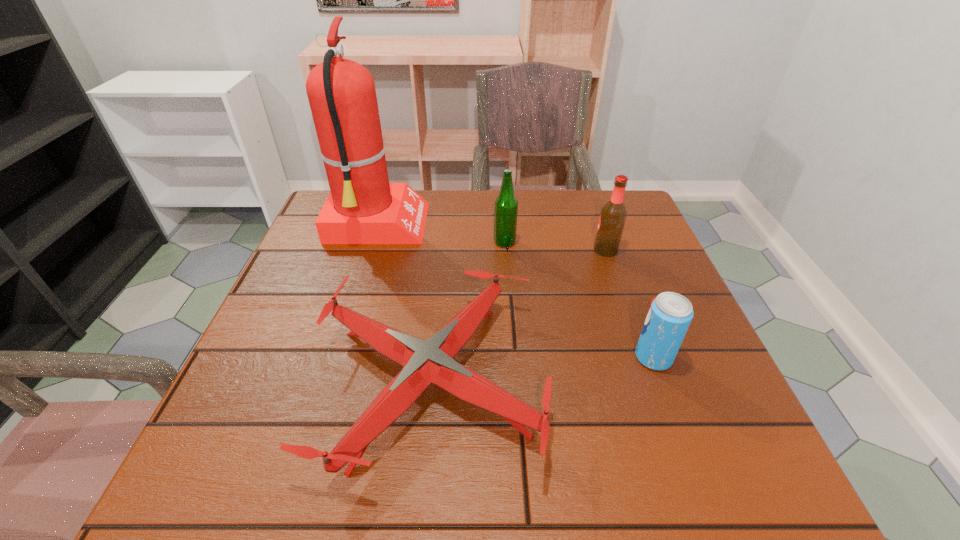
You are a GUI agent. You are given a task and a screenshot of the screen. Output one action in this format:
    pyautogui.click(x=<x>, y=<y>)
    Task: Click on the free space located 0.120m on the back of the soda can
    This screenshot has height=540, width=960.
    Given the screenshot: What is the action you would take?
    pyautogui.click(x=633, y=301)

At what (x,y) coordinates should I click in order to perform the action: click on vacant space located 0.210m on the right of the drone. Please return your answer as a coordinate pair (x, y). The image size is (960, 540). Looking at the image, I should click on (657, 380).

Locate an element on the screen. The height and width of the screenshot is (540, 960). fire extinguisher that is at the far edge is located at coordinates (363, 207).

Locate an element on the screen. This screenshot has width=960, height=540. beer bottle that is at the far edge is located at coordinates (506, 205).

Where is `object located at the near edge`? object located at the near edge is located at coordinates (424, 362).

Find the location of a particular element. This screenshot has height=540, width=960. fire extinguisher present at the left edge is located at coordinates (363, 207).

The image size is (960, 540). What are the coordinates of `drone that is positioned at the left edge` in the screenshot? It's located at (424, 362).

This screenshot has height=540, width=960. What are the coordinates of `beer bottle situated at the right edge` in the screenshot? It's located at (613, 215).

Where is `soda can situated at the right edge`? soda can situated at the right edge is located at coordinates (670, 314).

The image size is (960, 540). In order to click on object at the far left corner in this screenshot , I will do tap(363, 207).